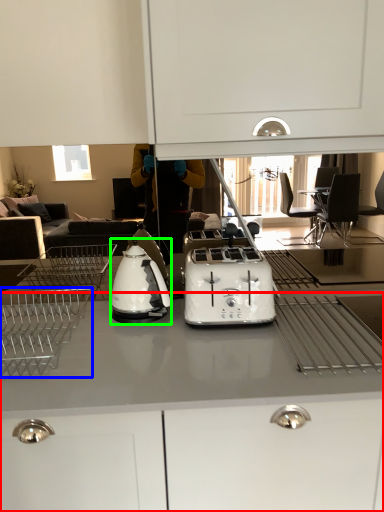
Question: Which is nearer to the cabinetry (highlighted by a red box)? home appliance (highlighted by a blue box) or kitchen appliance (highlighted by a green box).

Choices:
 (A) home appliance
 (B) kitchen appliance

Answer: (A)